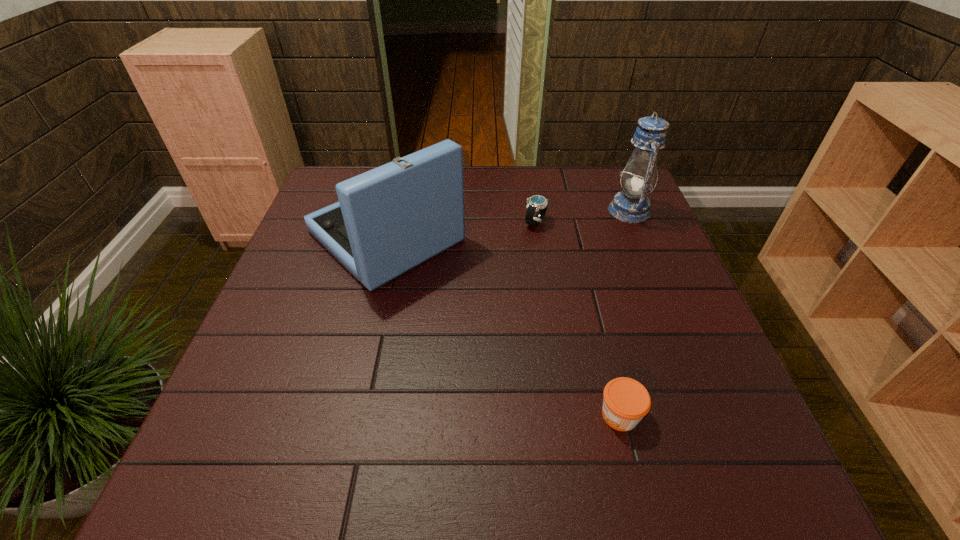
Find the location of a particular element. The image size is (960, 540). vacant space that's between the jam and the third object from right to left is located at coordinates (578, 319).

Find the location of a particular element. The image size is (960, 540). unoccupied position between the nearest object and the watch is located at coordinates (578, 319).

Select which object is the second closest to the nearest object. Please provide its 2D coordinates. Your answer should be formatted as a tuple, i.e. [(x, y)], where the tuple contains the x and y coordinates of a point satisfying the conditions above.

[(538, 204)]

Where is `object that is the second nearest to the phonograph record`? object that is the second nearest to the phonograph record is located at coordinates point(626,401).

Find the location of a particular element. The height and width of the screenshot is (540, 960). free spot that satisfies the following two spatial constraints: 1. on the front-facing side of the rightmost object; 2. on the front side of the third object from right to left is located at coordinates (634, 222).

The height and width of the screenshot is (540, 960). In order to click on vacant space that satisfies the following two spatial constraints: 1. on the front-facing side of the rightmost object; 2. on the front side of the third object from right to left in this screenshot , I will do `click(634, 222)`.

Where is `vacant space that satisfies the following two spatial constraints: 1. on the front-facing side of the lantern; 2. on the front side of the third object from right to left`? vacant space that satisfies the following two spatial constraints: 1. on the front-facing side of the lantern; 2. on the front side of the third object from right to left is located at coordinates (634, 222).